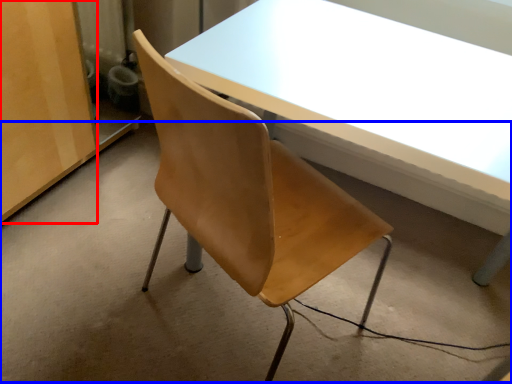
Question: Which of the following is the farthest to the observer, plywood (highlighted by a red box) or concrete (highlighted by a blue box)?

Choices:
 (A) plywood
 (B) concrete

Answer: (A)